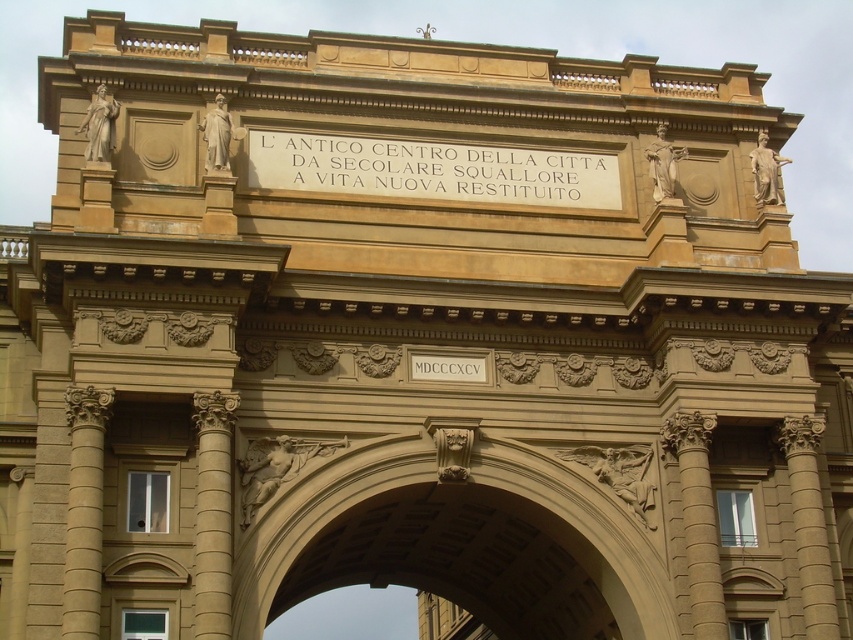
Is white stone plaque at center smaller than beige stone column at left?

Actually, white stone plaque at center might be larger than beige stone column at left.

The width and height of the screenshot is (853, 640). I want to click on white stone plaque at center, so click(432, 170).

This screenshot has width=853, height=640. In order to click on white stone plaque at center in this screenshot , I will do `click(432, 170)`.

This screenshot has width=853, height=640. What do you see at coordinates (432, 170) in the screenshot? I see `white stone plaque at center` at bounding box center [432, 170].

Which is below, white stone plaque at center or beige stone column at center?

beige stone column at center is below.

The width and height of the screenshot is (853, 640). Describe the element at coordinates (432, 170) in the screenshot. I see `white stone plaque at center` at that location.

At what (x,y) coordinates should I click in order to perform the action: click on white stone plaque at center. Please return your answer as a coordinate pair (x, y). Image resolution: width=853 pixels, height=640 pixels. Looking at the image, I should click on (432, 170).

Is beige stone archway at center smaller than white stone plaque at center?

Actually, beige stone archway at center might be larger than white stone plaque at center.

Is beige stone archway at center below white stone plaque at center?

Indeed, beige stone archway at center is positioned under white stone plaque at center.

Where is `beige stone archway at center`? Image resolution: width=853 pixels, height=640 pixels. beige stone archway at center is located at coordinates (457, 541).